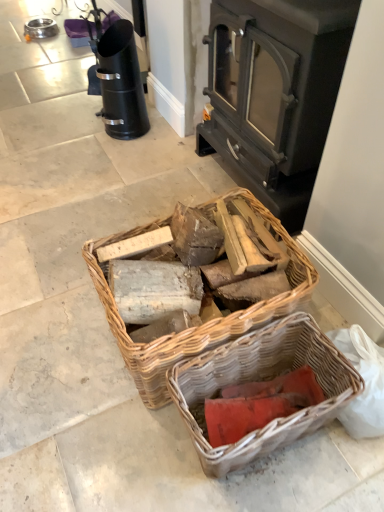
The height and width of the screenshot is (512, 384). I want to click on vacant area that lies in front of red cardboard at lower center, so click(253, 484).